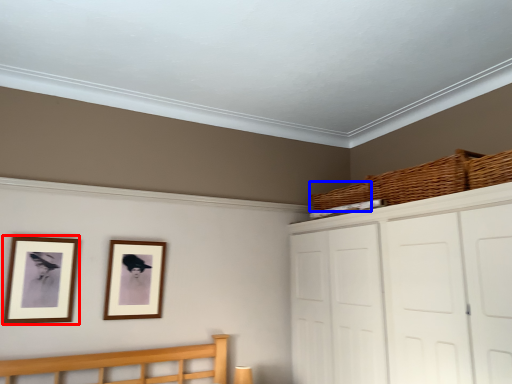
Question: Which object appears closest to the camera in this image, picture frame (highlighted by a red box) or basket (highlighted by a blue box)?

Choices:
 (A) picture frame
 (B) basket

Answer: (A)